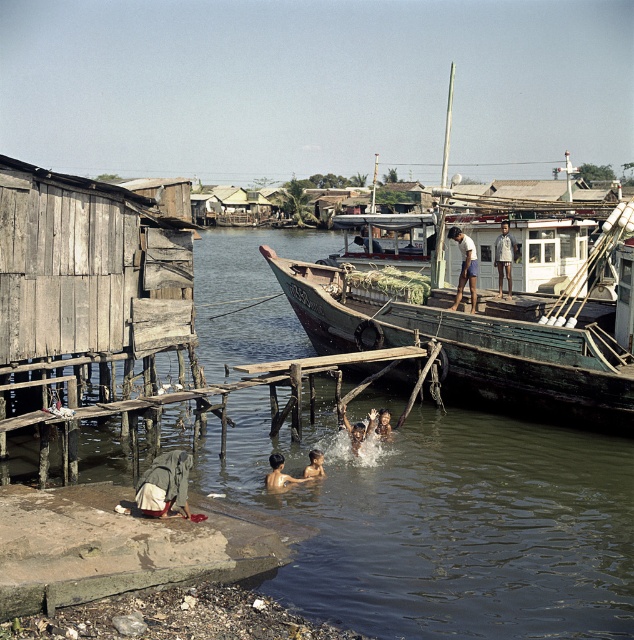
Question: Can you confirm if concrete dock at lower left is positioned to the right of light brown fabric shirt at upper right?

Choices:
 (A) yes
 (B) no

Answer: (B)

Question: Which point is farther to the camera?

Choices:
 (A) (462, 468)
 (B) (281, 477)
 (C) (495, 248)

Answer: (C)

Question: Which is farther from the light brown fabric shirt at upper right?

Choices:
 (A) green wooden boat at center
 (B) white cotton shirt at upper center
 (C) green fabric bag at lower left
 (D) greenish-brown water at center

Answer: (C)

Question: Which point is closer to the camera?

Choices:
 (A) light brown skin at water center
 (B) green wooden boat at center

Answer: (A)

Question: Can you confirm if green wooden boat at center is positioned below green fabric bag at lower left?

Choices:
 (A) no
 (B) yes

Answer: (A)

Question: Is concrete dock at lower left thinner than light brown skin at water center?

Choices:
 (A) no
 (B) yes

Answer: (A)